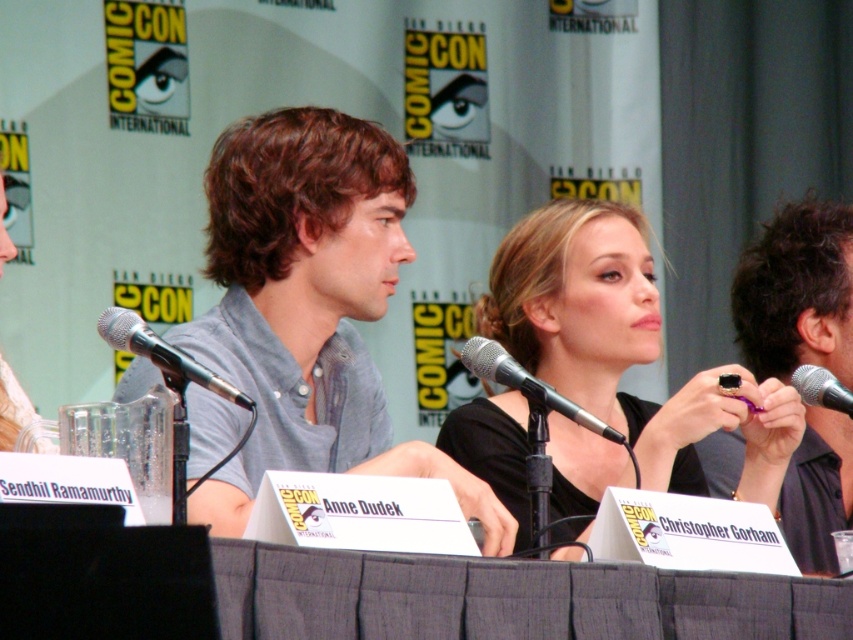
You are a photographer at Comic Con. You need to capture a photo of the panel discussion with both the silver metallic microphone at left and the black metallic microphone at center in the frame. Which microphone should you focus on to ensure both are in the shot without moving the camera?

The silver metallic microphone at left is shorter than the black metallic microphone at center. Since the silver microphone is shorter, focusing on the taller black microphone at center would help ensure both are in frame without needing to adjust the camera position.

You are a photographer at the event and need to capture a closeup of the black plastic ring at right and the black metallic microphone at right. Which object is positioned higher on the table?

The black plastic ring at right is above the black metallic microphone at right, so it is positioned higher on the table.